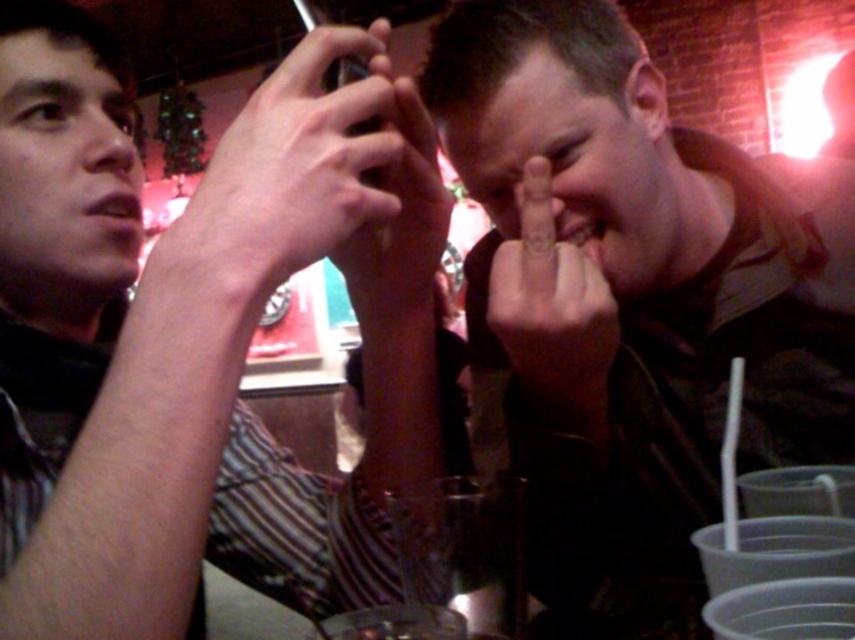
Can you confirm if matte black phone at upper left is positioned above matte black phone at upper center?

No, matte black phone at upper left is not above matte black phone at upper center.

Measure the distance between matte black phone at upper left and camera.

matte black phone at upper left and camera are 27.32 centimeters apart.

Identify the location of matte black phone at upper left. Image resolution: width=855 pixels, height=640 pixels. (198, 339).

In the scene shown: Is matte black phone at upper center shorter than smooth skin hand at center?

No.

Can you confirm if matte black phone at upper center is taller than smooth skin hand at center?

Yes.

Is point (342, 26) closer to camera compared to point (582, 353)?

Yes, it is.

Where is `matte black phone at upper center`? The height and width of the screenshot is (640, 855). matte black phone at upper center is located at coordinates (284, 173).

Which is above, dark brown leather jacket at center or matte black phone at upper center?

matte black phone at upper center is above.

Can you confirm if dark brown leather jacket at center is positioned to the left of matte black phone at upper center?

No, dark brown leather jacket at center is not to the left of matte black phone at upper center.

Identify the location of dark brown leather jacket at center. (635, 292).

Find the location of a particular element. The image size is (855, 640). dark brown leather jacket at center is located at coordinates (635, 292).